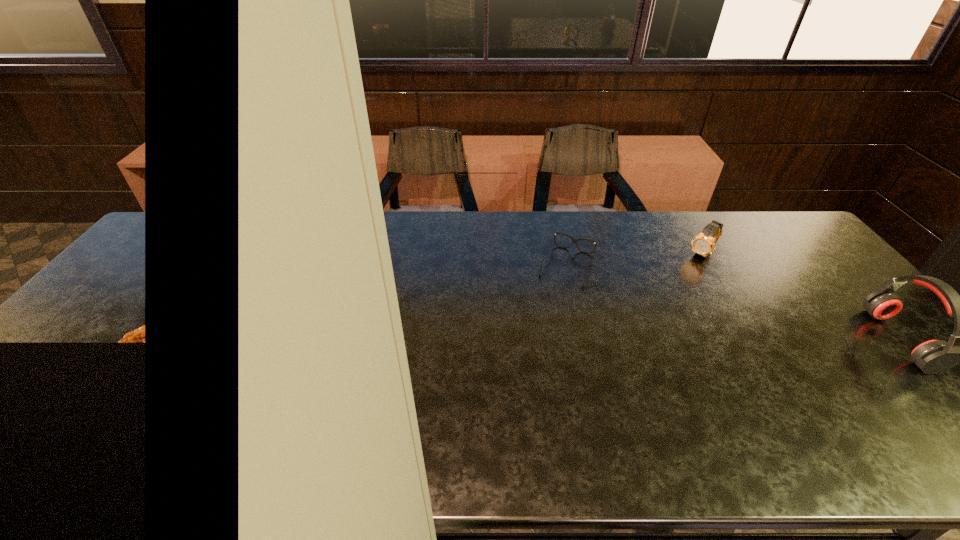
Find the location of `vacant space located with the lenses facing outward on the leftmost object`. vacant space located with the lenses facing outward on the leftmost object is located at coordinates (552, 305).

Where is `vacant area situated 0.290m with the lenses facing outward on the leftmost object`? vacant area situated 0.290m with the lenses facing outward on the leftmost object is located at coordinates (531, 357).

I want to click on vacant area located 0.140m on the face of the second object from left to right, so click(674, 282).

This screenshot has width=960, height=540. What are the coordinates of `free space located on the face of the second object from left to right` in the screenshot? It's located at (676, 280).

Find the location of a particular element. This screenshot has width=960, height=540. vacant space located 0.090m on the face of the second object from left to right is located at coordinates point(682,274).

Locate an element on the screen. The image size is (960, 540). spectacles that is at the far edge is located at coordinates (573, 240).

I want to click on watch that is at the far edge, so click(703, 244).

The height and width of the screenshot is (540, 960). Identify the location of object positioned at the right edge. (935, 356).

The width and height of the screenshot is (960, 540). What are the coordinates of `vacant space at the far edge of the desktop` in the screenshot? It's located at (501, 243).

Find the location of `free space at the near edge`. free space at the near edge is located at coordinates (130, 417).